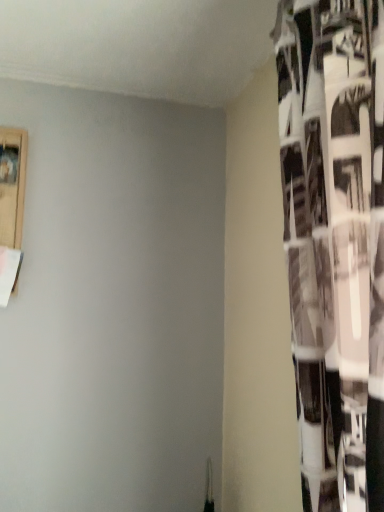
Image resolution: width=384 pixels, height=512 pixels. I want to click on black and white printed curtain at right, so click(335, 241).

What do you see at coordinates (335, 241) in the screenshot?
I see `black and white printed curtain at right` at bounding box center [335, 241].

The image size is (384, 512). I want to click on black and white printed curtain at right, so click(335, 241).